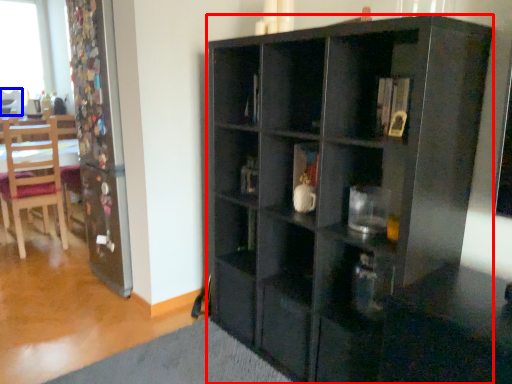
Question: Which object appears closest to the camera in this image, cabinetry (highlighted by a red box) or chair (highlighted by a blue box)?

Choices:
 (A) cabinetry
 (B) chair

Answer: (A)